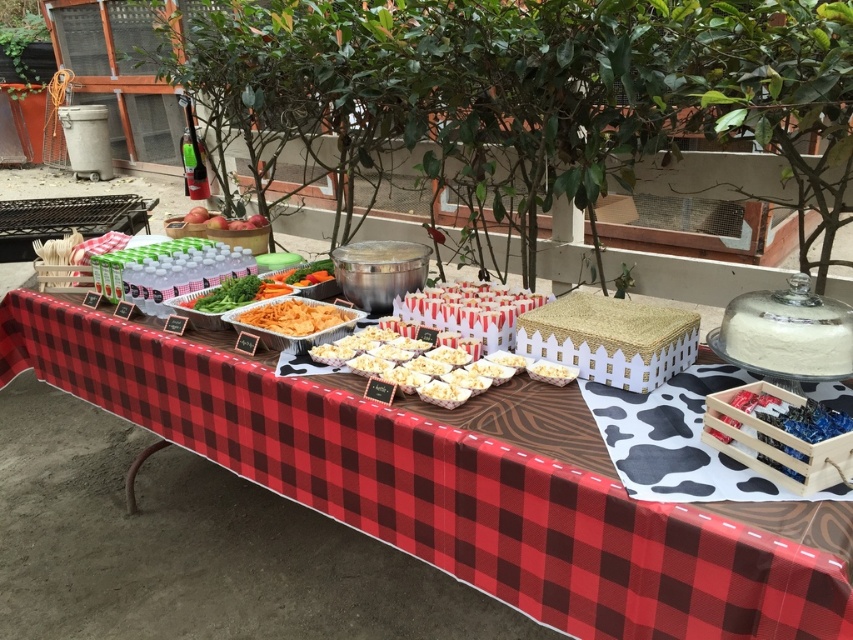
Measure the distance from red plaid tablecloth at center to wooden crate at lower right.

red plaid tablecloth at center is 4.24 feet away from wooden crate at lower right.

Which is more to the left, red plaid tablecloth at center or wooden crate at lower right?

red plaid tablecloth at center is more to the left.

Identify the location of red plaid tablecloth at center. (192, 547).

Locate an element on the screen. red plaid tablecloth at center is located at coordinates (192, 547).

Locate an element on the screen. This screenshot has width=853, height=640. red plaid tablecloth at center is located at coordinates (192, 547).

Is red plaid tablecloth at center below green leafy vegetables at center?

Yes, red plaid tablecloth at center is below green leafy vegetables at center.

Image resolution: width=853 pixels, height=640 pixels. What are the coordinates of `red plaid tablecloth at center` in the screenshot? It's located at (192, 547).

At what (x,y) coordinates should I click in order to perform the action: click on red plaid tablecloth at center. Please return your answer as a coordinate pair (x, y). The width and height of the screenshot is (853, 640). Looking at the image, I should click on (192, 547).

Which is behind, point (306, 273) or point (288, 317)?

Point (306, 273)

Is point (273, 276) positioned in front of point (283, 317)?

No, it is behind (283, 317).

Between point (192, 298) and point (347, 317), which one is positioned behind?

Positioned behind is point (192, 298).

Identify the location of green leafy vegetables at center. (260, 288).